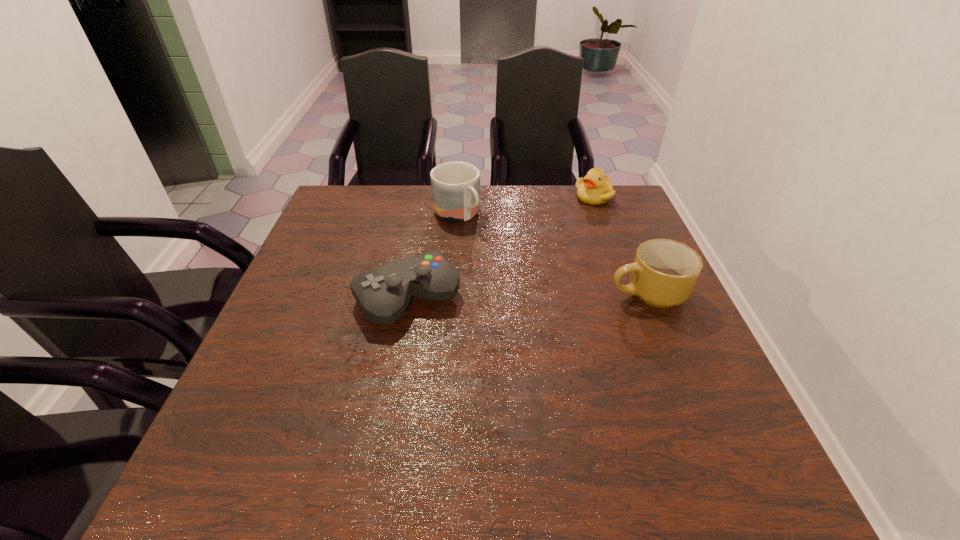
Locate an element on the screen. The width and height of the screenshot is (960, 540). vacant space located 0.330m on the front-facing side of the duckling is located at coordinates (563, 271).

Find the location of `blank area located 0.140m on the front-facing side of the duckling`. blank area located 0.140m on the front-facing side of the duckling is located at coordinates (580, 231).

Identify the location of vacant space located 0.090m on the front-facing side of the duckling. (584, 221).

Where is `blank space located on the side with the handle of the farther mug`? This screenshot has height=540, width=960. blank space located on the side with the handle of the farther mug is located at coordinates (500, 259).

You are a GUI agent. You are given a task and a screenshot of the screen. Output one action in this format:
    pyautogui.click(x=<x>, y=<y>)
    Task: Click on the free space located 0.390m on the side with the handle of the farther mug
    The width and height of the screenshot is (960, 540).
    Given the screenshot: What is the action you would take?
    pyautogui.click(x=558, y=312)

You are a GUI agent. You are given a task and a screenshot of the screen. Output one action in this format:
    pyautogui.click(x=<x>, y=<y>)
    Task: Click on the free space located on the side with the handle of the farther mug
    This screenshot has height=540, width=960.
    Given the screenshot: What is the action you would take?
    pyautogui.click(x=494, y=253)

The image size is (960, 540). In order to click on duckling that is at the far edge in this screenshot , I will do `click(595, 188)`.

I want to click on mug present at the far edge, so click(x=455, y=185).

Locate an element on the screen. The height and width of the screenshot is (540, 960). mug located at the right edge is located at coordinates (664, 272).

Where is `duckling positioned at the right edge`? This screenshot has height=540, width=960. duckling positioned at the right edge is located at coordinates (595, 188).